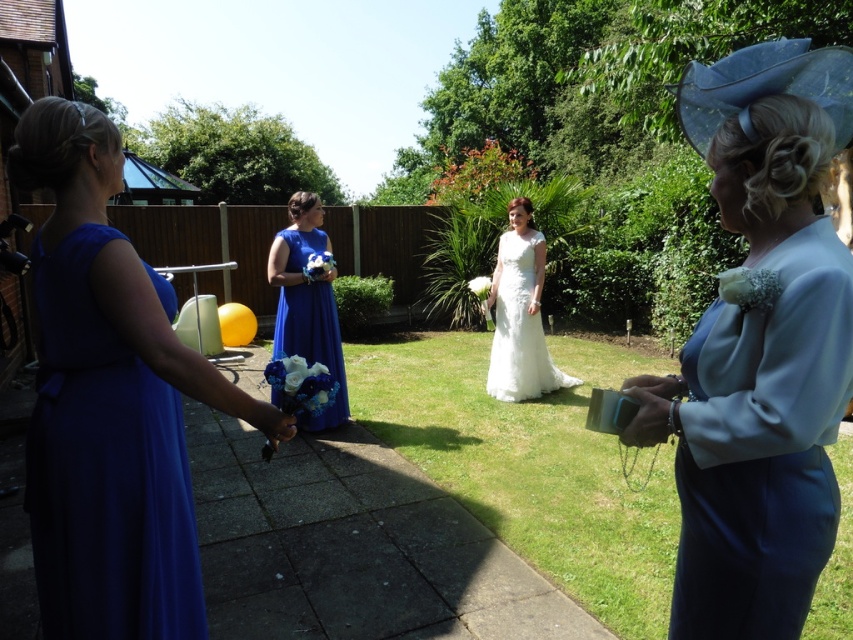
You are a photographer at a wedding event. You need to arrange the two women in royal blue dresses so that they fit within a 1.5 meter wide frame. The royal blue dress at left is wider than the royal blue satin dress at center. Which dress should be placed closer to the edge of the frame to ensure both fit?

The royal blue dress at left is wider than the royal blue satin dress at center. To ensure both fit within the 1.5 meter wide frame, place the wider royal blue dress at left closer to the edge so that there is enough space between them.

You are a photographer at the wedding and need to adjust the camera focus. The royal blue dress at left and the white lace dress at center are both in the frame. Which dress should you focus on if you want to capture the larger one?

The white lace dress at center is larger than the royal blue dress at left, so you should focus on the white lace dress at center to capture the larger one.

You are a photographer at a wedding and you need to capture a photo of both the royal blue dress at left and the white lace dress at center. Based on their positions, which dress is closer to the camera?

The royal blue dress at left is closer to the camera because it is in front of the white lace dress at center.